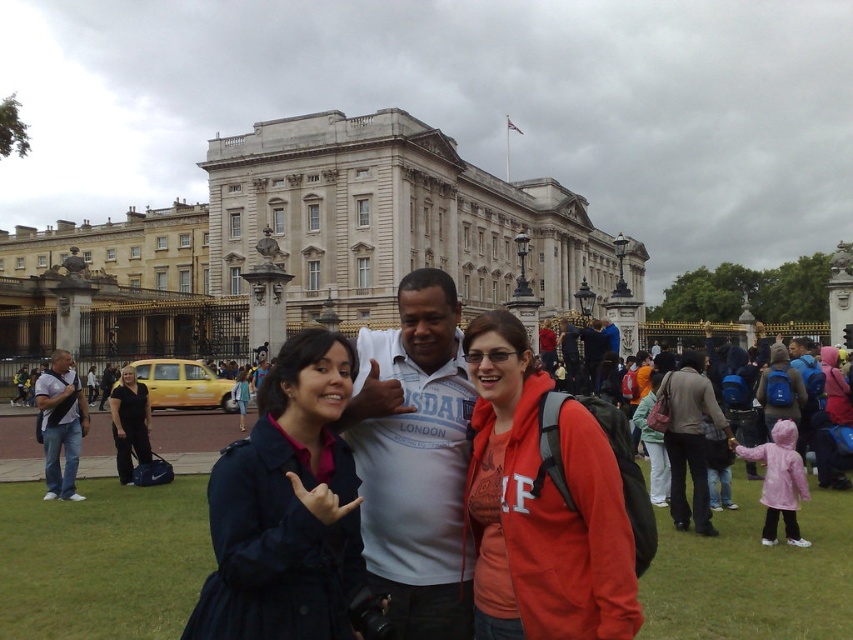
Does white stone building at center have a greater height compared to dark blue coat at center?

Yes, white stone building at center is taller than dark blue coat at center.

Who is higher up, white stone building at center or dark blue coat at center?

white stone building at center is higher up.

Identify the location of white stone building at center. The height and width of the screenshot is (640, 853). (392, 218).

Find the location of a particular element. Image resolution: width=853 pixels, height=640 pixels. white stone building at center is located at coordinates (392, 218).

Is point (270, 618) in front of point (409, 616)?

Yes, point (270, 618) is in front of point (409, 616).

Is matte white shirt at center shorter than white cotton shirt at center?

Incorrect, matte white shirt at center's height does not fall short of white cotton shirt at center's.

What do you see at coordinates (413, 460) in the screenshot? This screenshot has height=640, width=853. I see `matte white shirt at center` at bounding box center [413, 460].

Locate an element on the screen. This screenshot has width=853, height=640. matte white shirt at center is located at coordinates (413, 460).

Is matte black backpack at left shorter than black fabric jacket at lower left?

No.

Is matte black backpack at left above black fabric jacket at lower left?

Indeed, matte black backpack at left is positioned over black fabric jacket at lower left.

What do you see at coordinates (61, 424) in the screenshot? I see `matte black backpack at left` at bounding box center [61, 424].

Image resolution: width=853 pixels, height=640 pixels. Identify the location of matte black backpack at left. (61, 424).